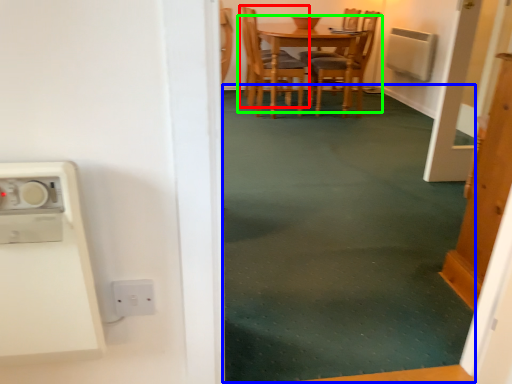
Question: Which object is the closest to the chair (highlighted by a red box)? Choose among these: plain (highlighted by a blue box) or kitchen & dining room table (highlighted by a green box).

Choices:
 (A) plain
 (B) kitchen & dining room table

Answer: (B)